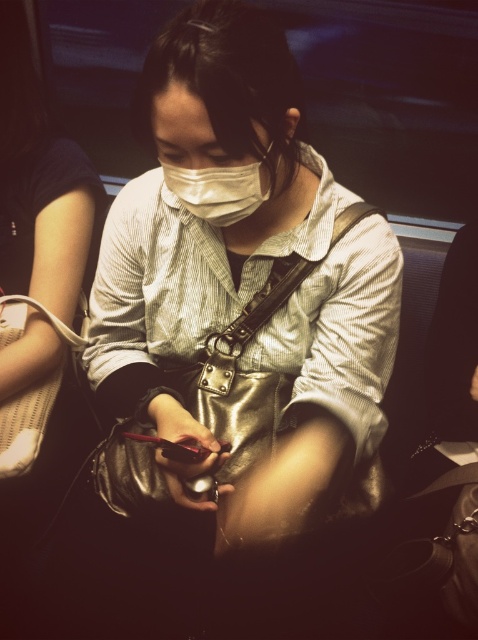
Question: Which point is farther to the camera?

Choices:
 (A) metallic purse at center
 (B) white matte mask at center

Answer: (B)

Question: Can you confirm if metallic purse at center is positioned to the left of white matte mask at center?

Choices:
 (A) yes
 (B) no

Answer: (A)

Question: Can you confirm if metallic purse at center is positioned above white matte mask at center?

Choices:
 (A) no
 (B) yes

Answer: (A)

Question: Among these points, which one is farthest from the camera?

Choices:
 (A) (348, 364)
 (B) (181, 177)

Answer: (A)

Question: Is metallic purse at center above white matte mask at center?

Choices:
 (A) yes
 (B) no

Answer: (B)

Question: Among these points, which one is nearest to the camera?

Choices:
 (A) (239, 177)
 (B) (89, 324)

Answer: (A)